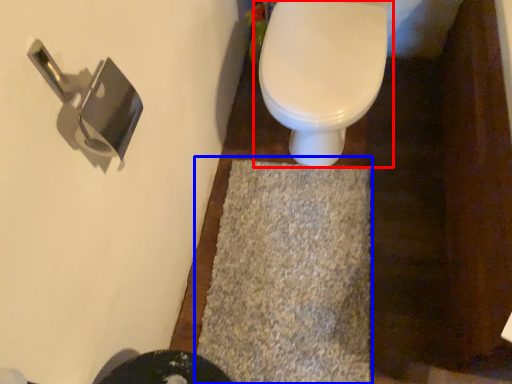
Question: Which object is closer to the camera taking this photo, toilet (highlighted by a red box) or bath mat (highlighted by a blue box)?

Choices:
 (A) toilet
 (B) bath mat

Answer: (A)